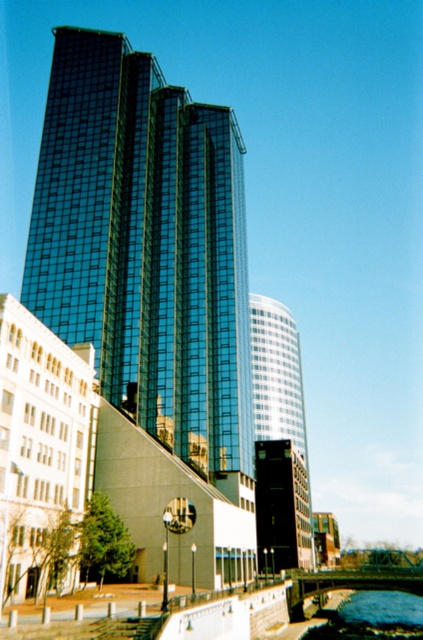
Question: Can you confirm if glassy reflective skyscraper at center is smaller than blue glassy water at lower center?

Choices:
 (A) yes
 (B) no

Answer: (B)

Question: Does glassy reflective skyscraper at center appear over blue glassy water at lower center?

Choices:
 (A) no
 (B) yes

Answer: (B)

Question: Is glassy reflective skyscraper at center smaller than blue glassy water at lower center?

Choices:
 (A) no
 (B) yes

Answer: (A)

Question: Which of the following is the closest to the observer?

Choices:
 (A) blue glassy water at lower center
 (B) glassy reflective skyscraper at center

Answer: (B)

Question: Which point is farther to the camera?

Choices:
 (A) blue glassy water at lower center
 (B) glassy reflective skyscraper at center

Answer: (A)